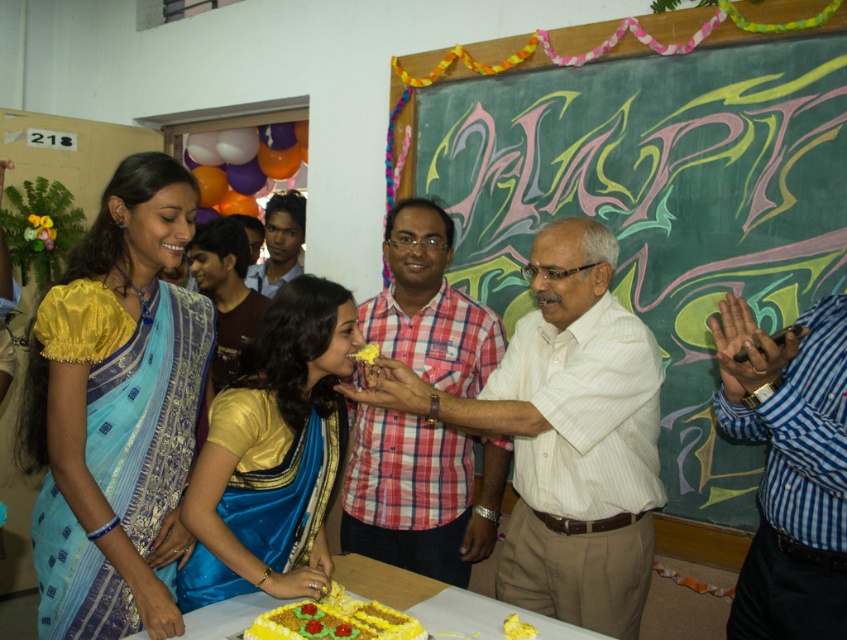
Who is more forward, (x=785, y=118) or (x=263, y=579)?

Point (x=263, y=579) is in front.

Between green chalkboard at upper center and gold satin saree at center, which one has less height?

gold satin saree at center is shorter.

Who is more forward, (779, 188) or (203, 486)?

Point (203, 486) is more forward.

This screenshot has height=640, width=847. I want to click on green chalkboard at upper center, so click(x=655, y=202).

Does white striped shirt at center appear over yellow satin saree at center?

No.

You are a GUI agent. You are given a task and a screenshot of the screen. Output one action in this format:
    pyautogui.click(x=<x>, y=<y>)
    Task: Click on the white striped shirt at center
    
    Given the screenshot: What is the action you would take?
    pyautogui.click(x=565, y=435)

Based on the photo, between green chalkboard at upper center and silk saree at left, which one has less height?

With less height is silk saree at left.

Can you confirm if green chalkboard at upper center is wider than silk saree at left?

Correct, the width of green chalkboard at upper center exceeds that of silk saree at left.

What do you see at coordinates (655, 202) in the screenshot? The width and height of the screenshot is (847, 640). I see `green chalkboard at upper center` at bounding box center [655, 202].

Locate an element on the screen. green chalkboard at upper center is located at coordinates (655, 202).